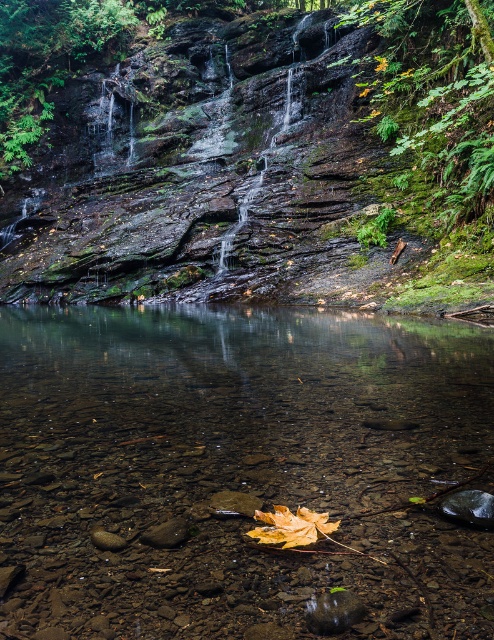
You are a hiker who wants to place a small 10 cm wide rock on the yellow matte maple leaf at lower center without overlapping the green mossy rock at upper center. Is this possible?

The green mossy rock at upper center might be wider than the yellow matte maple leaf at lower center, so placing a 10 cm wide rock on the leaf without overlapping the mossy rock is uncertain and may not be possible.

You are standing at the base of the cliff looking up. There is a point marked at coordinates (265, 164). Which object from the scene does this point lie on?

The point at coordinates (265, 164) lies on the green mossy rock at upper center.